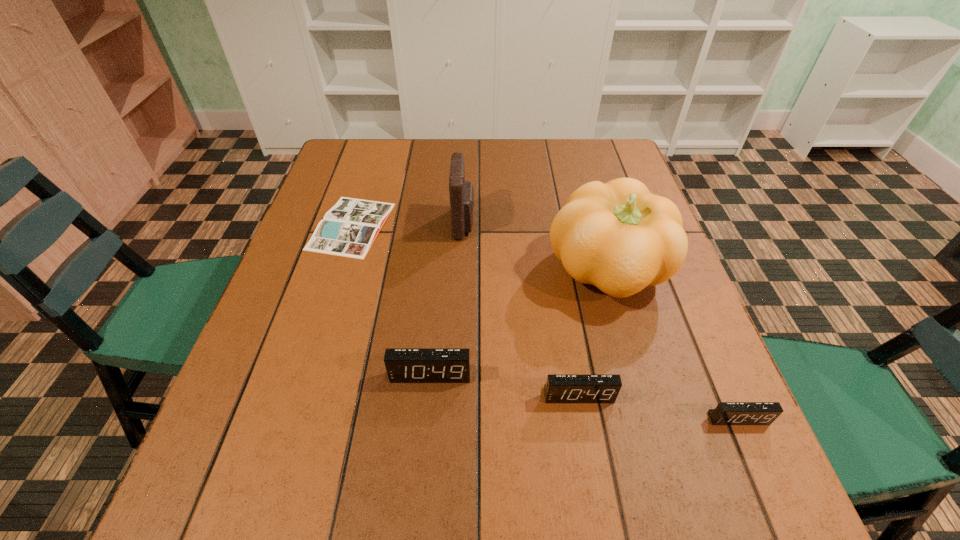
This screenshot has height=540, width=960. I want to click on vacant area at the left edge, so click(x=247, y=361).

The width and height of the screenshot is (960, 540). What are the coordinates of `free space at the right edge` in the screenshot? It's located at (630, 359).

Identify the location of vacant space at the far left corner of the desktop. This screenshot has width=960, height=540. (381, 167).

Image resolution: width=960 pixels, height=540 pixels. Identify the location of free space at the far right corner of the desktop. (574, 139).

The height and width of the screenshot is (540, 960). In order to click on free spot at the near right corner of the desktop in this screenshot , I will do `click(655, 448)`.

Where is `free spot between the shortest object and the rightmost alarm clock`? The image size is (960, 540). free spot between the shortest object and the rightmost alarm clock is located at coordinates (545, 322).

Identify the location of free area in between the farthest alarm clock and the second tallest alarm clock. pyautogui.click(x=504, y=385).

Where is `free spot between the leftmost object and the second farthest alarm clock`? The width and height of the screenshot is (960, 540). free spot between the leftmost object and the second farthest alarm clock is located at coordinates (465, 310).

The image size is (960, 540). Find the location of `vacant space in between the second nearest object and the nearest alarm clock`. vacant space in between the second nearest object and the nearest alarm clock is located at coordinates (659, 407).

The image size is (960, 540). What are the coordinates of `unoccupied position between the tallest object and the second tallest alarm clock` in the screenshot? It's located at (593, 333).